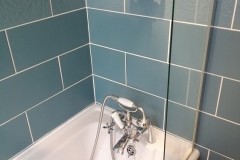
Please find where you turn on the water in the image and show me where they are. Your answer should be formatted as a list of tuples, i.e. [(x1, y1), (x2, y2), ...], where each tuple contains the x and y coordinates of a point satisfying the conditions above.

[(107, 127)]